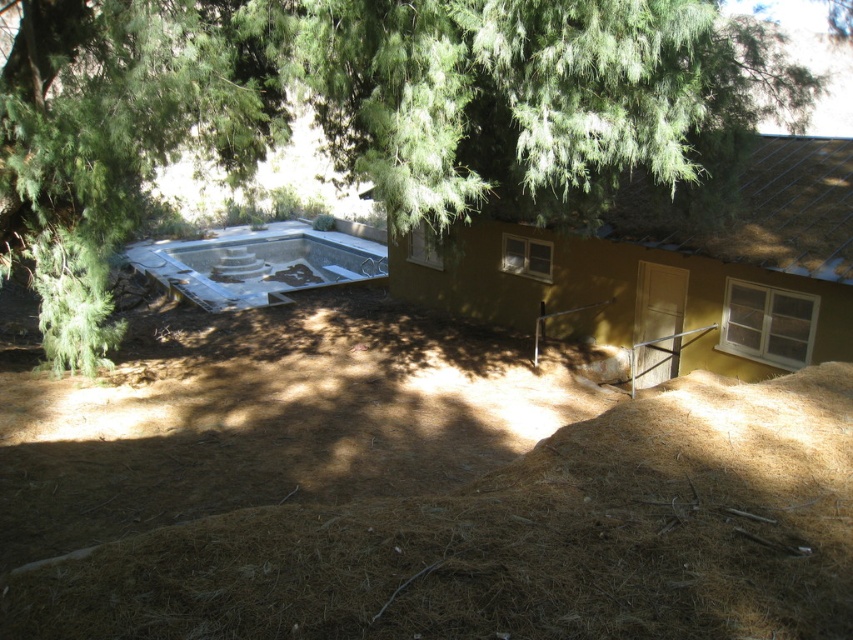
You are standing at the lower center of the scene. Looking up, which object would you see first between the green leafy tree at upper center and the brown dry hay at lower center?

The green leafy tree at upper center would be seen first when looking up from the lower center position because it is located above the brown dry hay at lower center.

You are standing in the outdoor scene and want to know which of the two points, point (164, 125) or point (805, 524), is closer to you. Can you determine this based on their positions?

Point (164, 125) is further to the camera than point (805, 524), so point (805, 524) is closer to you.

You are a landscape architect designing a garden. You want to place a 4.5 meter long decorative fence between the green leafy tree at upper center and the brown dry hay at lower center. Is there enough space to fit the fence between them?

The distance between the green leafy tree at upper center and the brown dry hay at lower center is 4.51 meters, which is just enough to fit a 4.5 meter long decorative fence between them.